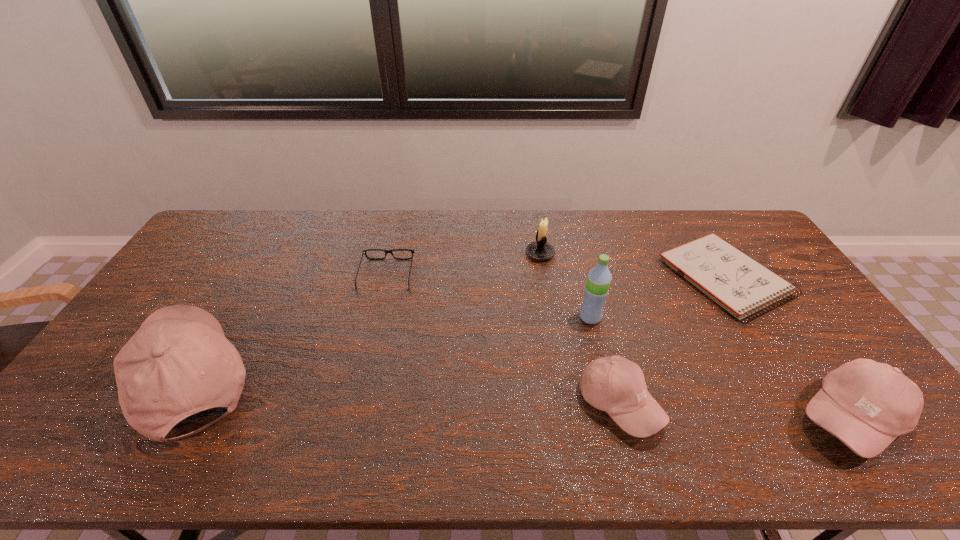
Please point a location where one more baseball_cap can be added evenly. Please provide its 2D coordinates. Your answer should be formatted as a tuple, i.e. [(x, y)], where the tuple contains the x and y coordinates of a point satisfying the conditions above.

[(399, 390)]